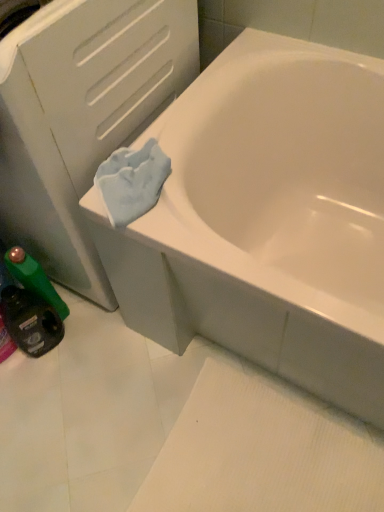
Question: Is green plastic mouthwash at lower left, which appears as the second mouthwash when viewed from the top, oriented away from green plastic bottle at lower left, the 1th mouthwash in the top-to-bottom sequence?

Choices:
 (A) no
 (B) yes

Answer: (B)

Question: Is green plastic mouthwash at lower left, which appears as the second mouthwash when viewed from the top, in front of green plastic bottle at lower left, the 1th mouthwash in the top-to-bottom sequence?

Choices:
 (A) no
 (B) yes

Answer: (B)

Question: Does green plastic mouthwash at lower left, the first mouthwash positioned from the bottom, appear on the left side of green plastic bottle at lower left, which is counted as the 2th mouthwash, starting from the bottom?

Choices:
 (A) yes
 (B) no

Answer: (A)

Question: From the image's perspective, does green plastic mouthwash at lower left, the first mouthwash positioned from the bottom, appear lower than green plastic bottle at lower left, the 1th mouthwash in the top-to-bottom sequence?

Choices:
 (A) no
 (B) yes

Answer: (B)

Question: Considering the relative sizes of green plastic mouthwash at lower left, which appears as the second mouthwash when viewed from the top, and green plastic bottle at lower left, the 1th mouthwash in the top-to-bottom sequence, in the image provided, is green plastic mouthwash at lower left, which appears as the second mouthwash when viewed from the top, bigger than green plastic bottle at lower left, the 1th mouthwash in the top-to-bottom sequence,?

Choices:
 (A) yes
 (B) no

Answer: (A)

Question: Is point (238, 114) positioned closer to the camera than point (56, 340)?

Choices:
 (A) closer
 (B) farther

Answer: (A)

Question: From their relative heights in the image, would you say white glossy bathtub at upper right is taller or shorter than green plastic mouthwash at lower left, which appears as the second mouthwash when viewed from the top?

Choices:
 (A) tall
 (B) short

Answer: (A)

Question: From the image's perspective, is white glossy bathtub at upper right located above or below green plastic mouthwash at lower left, the first mouthwash positioned from the bottom?

Choices:
 (A) above
 (B) below

Answer: (A)

Question: Is white glossy bathtub at upper right spatially inside green plastic mouthwash at lower left, the first mouthwash positioned from the bottom, or outside of it?

Choices:
 (A) inside
 (B) outside

Answer: (B)

Question: Is white matte file cabinet at upper left in front of or behind white glossy bathtub at upper right in the image?

Choices:
 (A) behind
 (B) front

Answer: (A)

Question: Considering the positions of white matte file cabinet at upper left and white glossy bathtub at upper right in the image, is white matte file cabinet at upper left wider or thinner than white glossy bathtub at upper right?

Choices:
 (A) thin
 (B) wide

Answer: (A)

Question: Is white matte file cabinet at upper left spatially inside white glossy bathtub at upper right, or outside of it?

Choices:
 (A) inside
 (B) outside

Answer: (B)

Question: From a real-world perspective, relative to white glossy bathtub at upper right, is white matte file cabinet at upper left vertically above or below?

Choices:
 (A) above
 (B) below

Answer: (A)

Question: Is point (31, 275) closer or farther from the camera than point (56, 322)?

Choices:
 (A) closer
 (B) farther

Answer: (A)

Question: From a real-world perspective, is green plastic bottle at lower left, which is counted as the 2th mouthwash, starting from the bottom, above or below green plastic mouthwash at lower left, the first mouthwash positioned from the bottom?

Choices:
 (A) below
 (B) above

Answer: (B)